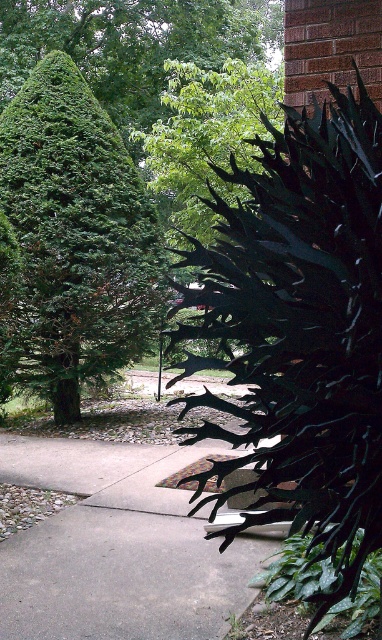
Who is more forward, (176, 556) or (51, 72)?

Point (176, 556) is in front.

Which is above, gray concrete pavement at center or green leafy tree at left?

Positioned higher is green leafy tree at left.

The height and width of the screenshot is (640, 382). Find the location of `gray concrete pavement at center`. gray concrete pavement at center is located at coordinates (118, 547).

Where is `gray concrete pavement at center`? Image resolution: width=382 pixels, height=640 pixels. gray concrete pavement at center is located at coordinates (118, 547).

Image resolution: width=382 pixels, height=640 pixels. What are the coordinates of `green matte bush at right` in the screenshot? It's located at (302, 324).

How much distance is there between green matte bush at right and gray concrete pavement at center?

green matte bush at right is 1.87 meters from gray concrete pavement at center.

Looking at this image, who is more forward, (354, 173) or (21, 532)?

Point (354, 173)

The height and width of the screenshot is (640, 382). What are the coordinates of `green matte bush at right` in the screenshot? It's located at (302, 324).

Who is positioned more to the left, green matte bush at right or green leafy tree at left?

green leafy tree at left is more to the left.

Who is shorter, green matte bush at right or green leafy tree at left?

green matte bush at right is shorter.

Identify the location of green matte bush at right. Image resolution: width=382 pixels, height=640 pixels. (302, 324).